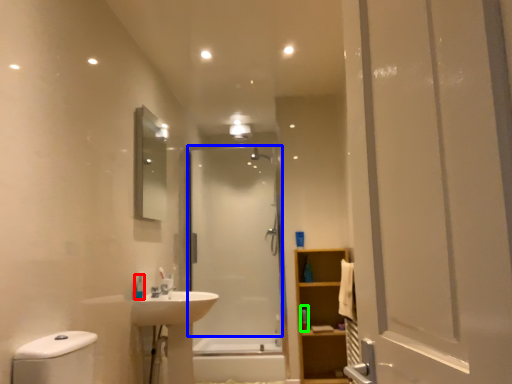
Question: Estimate the real-world distances between objects in this image. Which object is farther from toiletry (highlighted by a red box), screen door (highlighted by a blue box) or toiletry (highlighted by a green box)?

Choices:
 (A) screen door
 (B) toiletry

Answer: (A)